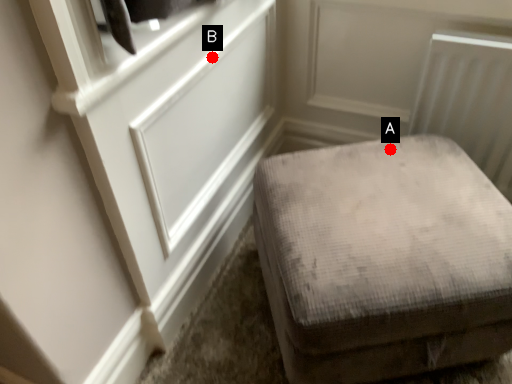
Question: Two points are circled on the image, labeled by A and B beside each circle. Which point is closer to the camera?

Choices:
 (A) A is closer
 (B) B is closer

Answer: (B)